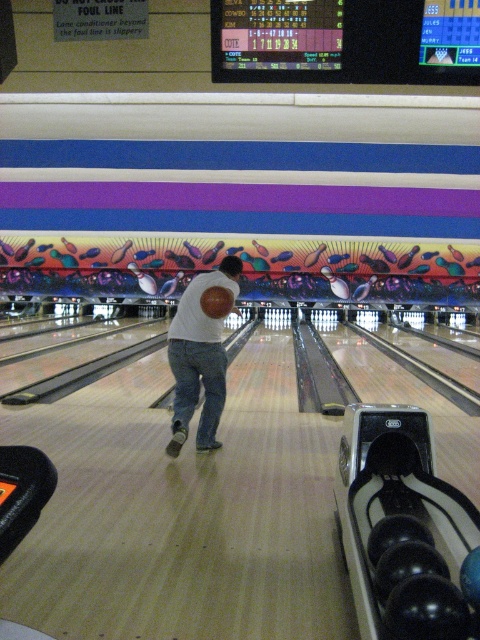
You are standing at the bowling alley and want to know which of the two points, point (x=184, y=316) or point (x=204, y=344), is closer to you. Can you determine this based on their positions?

Point (x=184, y=316) is further to the camera than point (x=204, y=344), so the closer point to you is point (x=204, y=344).

You are a robotic arm trying to pick up the white matte shirt at center and blue denim jeans at center. The robotic arm can only pick up items that are at least 3 inches apart. Can you pick up both items?

The white matte shirt at center is 2.83 inches away from blue denim jeans at center. Since the distance is less than 3 inches, the robotic arm cannot pick up both items.